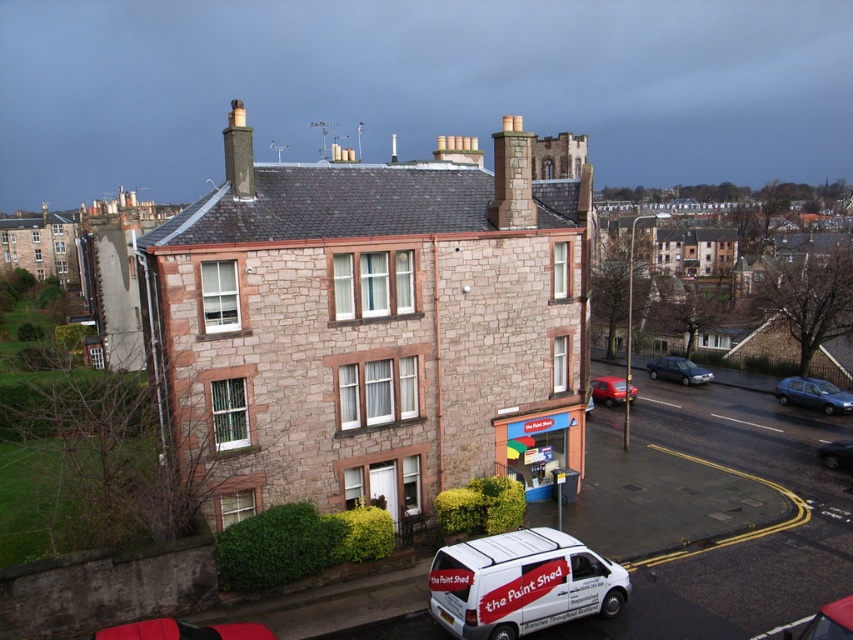
You are standing at the entrance of the Paint Shed and want to locate the stone chimney at center. According to the coordinates provided, in which direction should you look to see it?

The stone chimney at center is located at coordinates point (512, 177), so you should look towards the center of the building to see it.